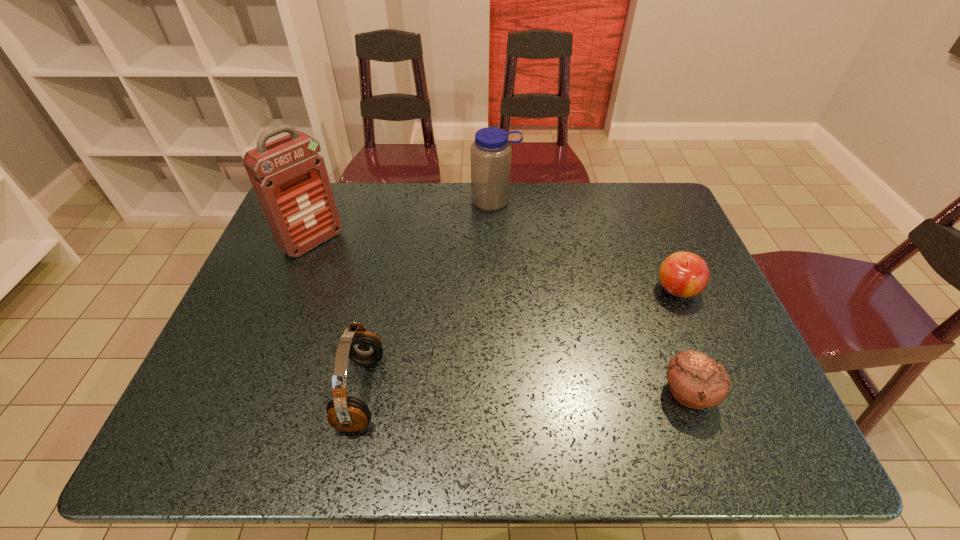
You are a GUI agent. You are given a task and a screenshot of the screen. Output one action in this format:
    pyautogui.click(x=<x>, y=<y>)
    Task: Click on the vacant point located between the water bottle and the muffin
    
    Given the screenshot: What is the action you would take?
    (x=591, y=297)

The width and height of the screenshot is (960, 540). In order to click on blank region between the muffin and the fourth shortest object in this screenshot , I will do `click(591, 297)`.

Find the location of `empty space between the muffin and the headset`. empty space between the muffin and the headset is located at coordinates (524, 393).

Find the location of a particular element. Image resolution: width=960 pixels, height=540 pixels. vacant area between the third farthest object and the muffin is located at coordinates (683, 341).

Find the location of a particular element. object that is the second closest to the headset is located at coordinates (491, 151).

Locate an element on the screen. the closest object relative to the farthest object is located at coordinates (290, 179).

Locate an element on the screen. This screenshot has width=960, height=540. vacant space that satisfies the following two spatial constraints: 1. on the front side of the leftmost object; 2. on the ear cups of the headset is located at coordinates (253, 392).

Find the location of a particular element. vacant area that satisfies the following two spatial constraints: 1. on the front side of the third shortest object; 2. on the ear cups of the second farthest object is located at coordinates (253, 392).